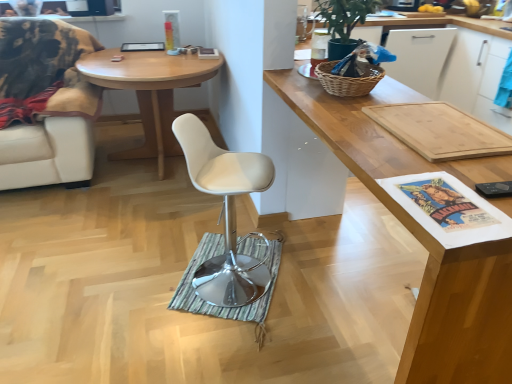
Where is `free space in front of green striped mat at center`? free space in front of green striped mat at center is located at coordinates (228, 346).